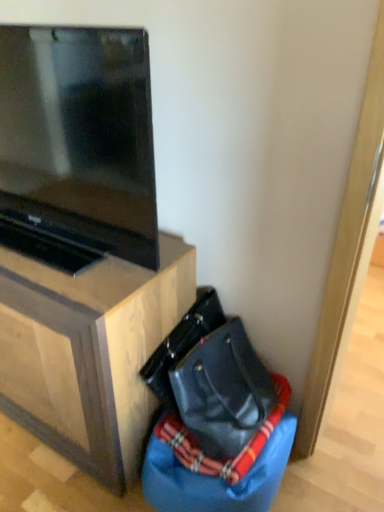
Image resolution: width=384 pixels, height=512 pixels. What are the coordinates of `free spot below matte black tv at upper left (from a real-world perspective)` in the screenshot? It's located at (71, 256).